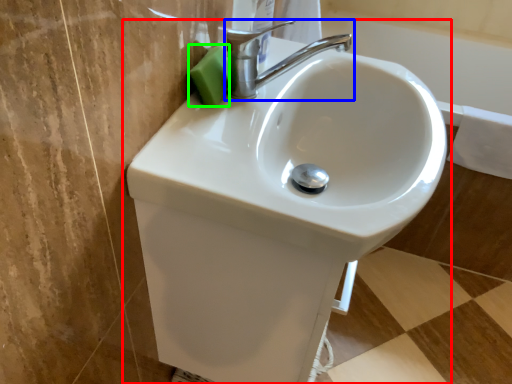
Question: Estimate the real-world distances between objects in this image. Which object is closer to sink (highlighted by a red box), tap (highlighted by a blue box) or soap (highlighted by a green box)?

Choices:
 (A) tap
 (B) soap

Answer: (A)